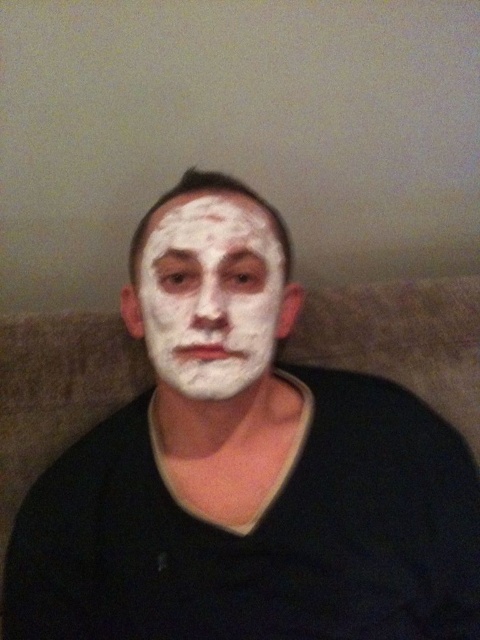
Who is taller, white matte face paint at center or white matte facial mask at center?

Standing taller between the two is white matte face paint at center.

Who is more forward, (x=172, y=384) or (x=276, y=300)?

Positioned in front is point (x=172, y=384).

Find the location of `white matte face paint at center`. white matte face paint at center is located at coordinates (244, 468).